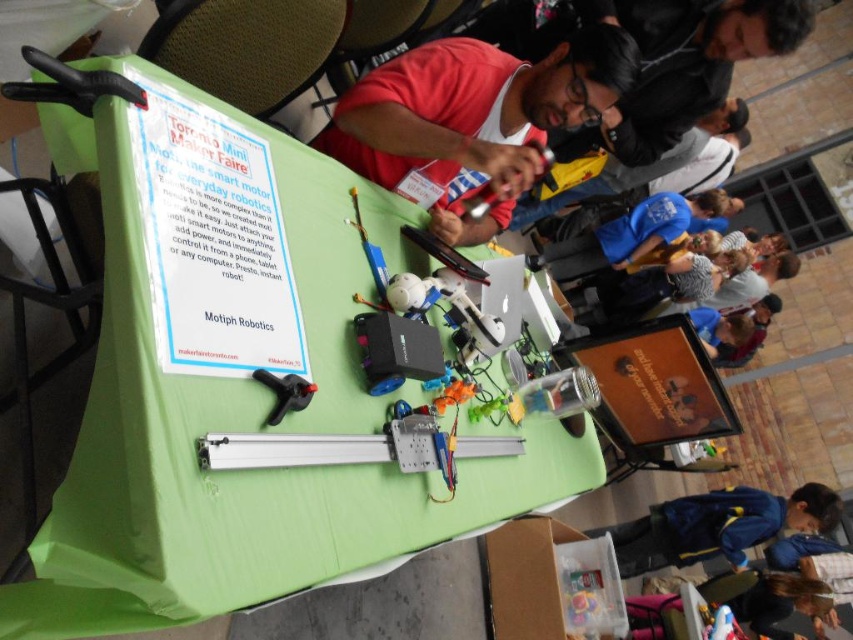
Based on the photo, you are attending the Toronto Mini Maker Faire and notice two items at the Motiph Robotics table. The red matte shirt at center and the orange matte signboard at center. Which item is located to the left of the other?

The red matte shirt at center is positioned on the left side of orange matte signboard at center, so the red matte shirt at center is to the left of the orange matte signboard at center.

You are setting up for an event and have both the green fabric table at center and the orange matte signboard at center. If you need to place a large display on the larger item, which object should you choose?

The green fabric table at center is larger in size than the orange matte signboard at center, so you should place the large display on the green fabric table at center.